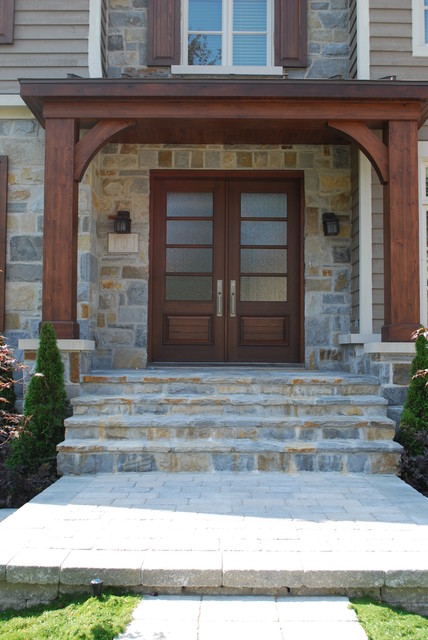
Identify the location of door handles. (219, 294), (232, 298).